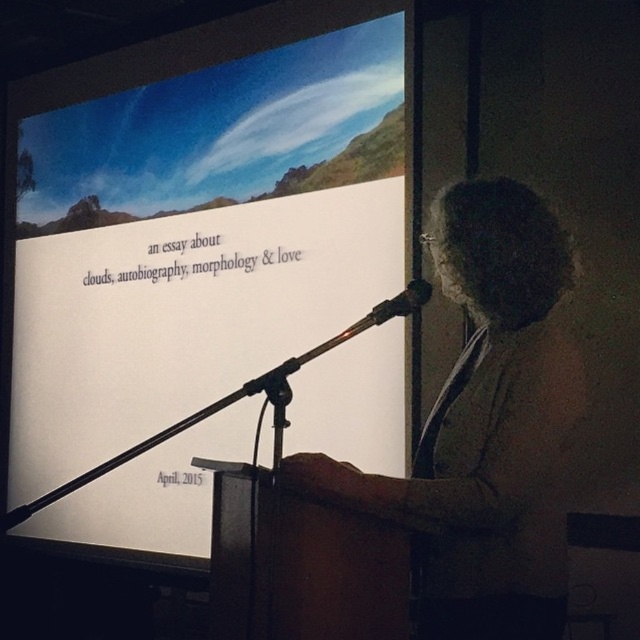
You are organizing a presentation and need to place a name tag for the speaker. The name tag is the size of the gray fabric at center. Will it fit on the white paper at upper center?

The white paper at upper center is bigger than the gray fabric at center, so the name tag will fit on the white paper at upper center.

You are an attendee at the presentation. You notice the white paper at upper center and the black metallic microphone at center. Which object is closer to you?

The white paper at upper center is closer to you than the black metallic microphone at center.